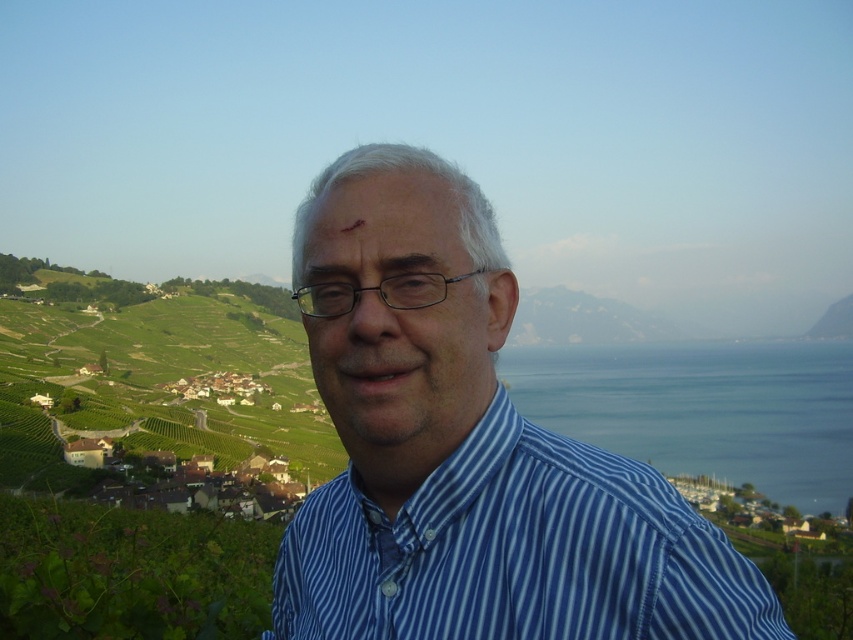
Question: Based on their relative distances, which object is farther from the blue water at right?

Choices:
 (A) matte skin at center
 (B) blue striped shirt at center

Answer: (A)

Question: Can you confirm if blue striped shirt at center is positioned to the right of matte skin at center?

Choices:
 (A) no
 (B) yes

Answer: (B)

Question: Can you confirm if blue striped shirt at center is positioned to the right of matte skin at center?

Choices:
 (A) yes
 (B) no

Answer: (A)

Question: Which of these objects is positioned closest to the matte skin at center?

Choices:
 (A) blue striped shirt at center
 (B) blue water at right

Answer: (A)

Question: Which point is farther to the camera?

Choices:
 (A) (518, 364)
 (B) (289, 561)

Answer: (A)

Question: Can you confirm if blue striped shirt at center is bigger than matte skin at center?

Choices:
 (A) yes
 (B) no

Answer: (A)